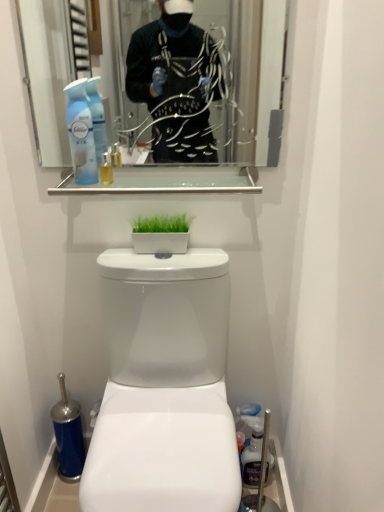
I want to click on free location in front of white glossy planter at center, so click(165, 263).